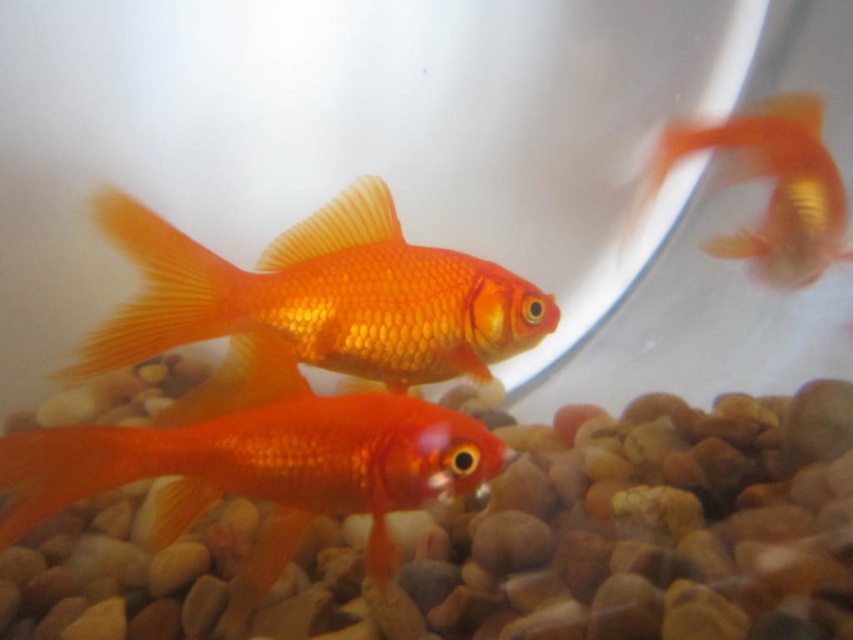
You are an aquarium caretaker who needs to ensure each goldfish has enough space to swim. Given that the shiny orange fish at center requires 2 liters of water per body size unit and the shiny orange goldfish at upper right needs 1.5 liters per unit, can both fish coexist in a 10 liter tank?

The shiny orange fish at center is larger than the shiny orange goldfish at upper right. Assuming the larger fish has a body size unit of X, it would require 2X liters, while the smaller one needs 1.5Y liters. If their combined requirement 2X 1.5Y exceeds 10 liters, they cannot coexist. However, without knowing their exact sizes, we can only state the relationship between their sizes, not the exact capacity.

You are an underwater explorer looking at the fish tank. You see the shiny orange fish at center and the shiny orange goldfish at upper right. Which one is closer to the bottom of the tank?

The shiny orange fish at center is located below the shiny orange goldfish at upper right, so it is closer to the bottom of the tank.